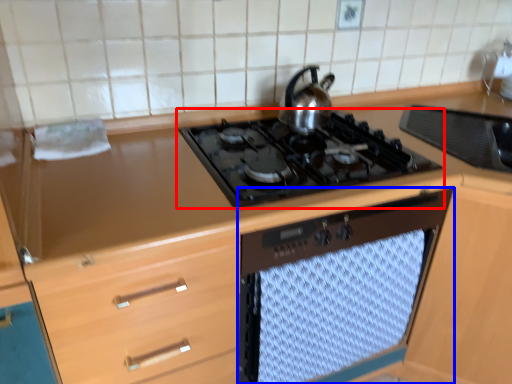
Question: Which of the following is the closest to the observer, gas stove (highlighted by a red box) or oven (highlighted by a blue box)?

Choices:
 (A) gas stove
 (B) oven

Answer: (A)